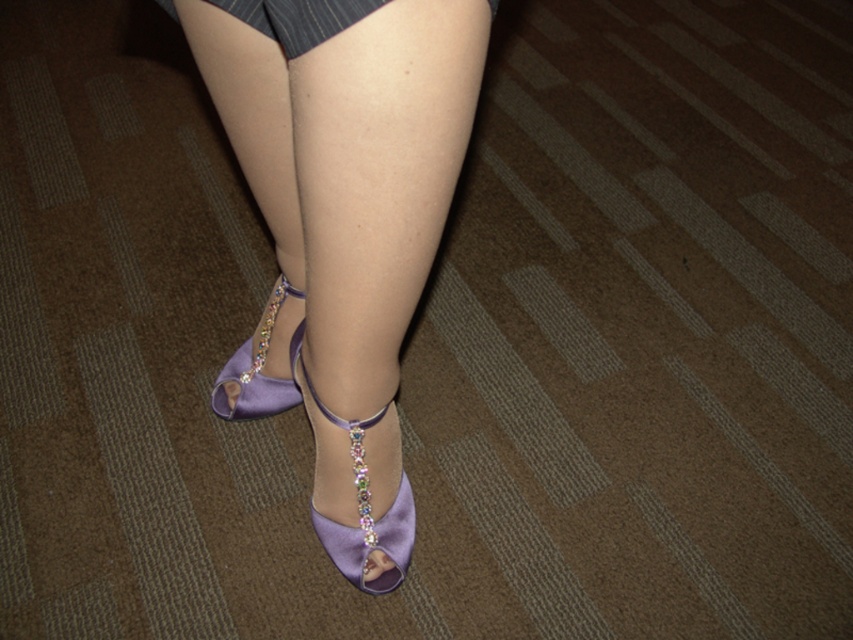
Is satin purple sandal at lower center behind satin purple high-heeled shoe at lower center?

No, it is in front of satin purple high-heeled shoe at lower center.

What do you see at coordinates (360, 502) in the screenshot? I see `satin purple sandal at lower center` at bounding box center [360, 502].

Does point (375, 522) come in front of point (260, 387)?

Yes, it is.

Identify the location of satin purple sandal at lower center. The width and height of the screenshot is (853, 640). (360, 502).

Can you confirm if satin purple sandal at lower center is smaller than dark gray textured fabric dress at upper center?

Yes, satin purple sandal at lower center is smaller than dark gray textured fabric dress at upper center.

Does satin purple sandal at lower center appear over dark gray textured fabric dress at upper center?

No.

What do you see at coordinates (360, 502) in the screenshot? I see `satin purple sandal at lower center` at bounding box center [360, 502].

The height and width of the screenshot is (640, 853). What are the coordinates of `satin purple sandal at lower center` in the screenshot? It's located at (x=360, y=502).

Is point (332, 385) closer to viewer compared to point (239, 412)?

Yes, it is in front of point (239, 412).

Does satin purple high-heeled shoe at center have a greater height compared to satin purple high-heeled shoe at lower center?

Correct, satin purple high-heeled shoe at center is much taller as satin purple high-heeled shoe at lower center.

Is point (281, 291) farther from camera compared to point (213, 387)?

No, it is in front of (213, 387).

I want to click on satin purple high-heeled shoe at center, so click(x=343, y=230).